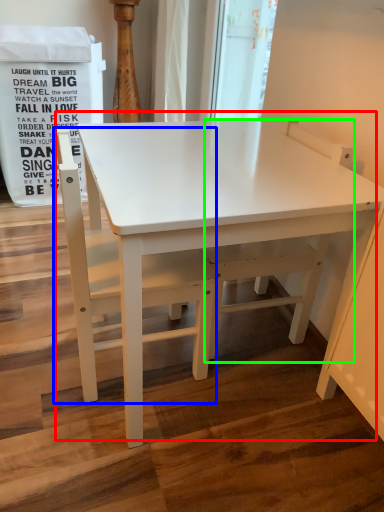
Question: Considering the real-world distances, which object is closest to table (highlighted by a red box)? chair (highlighted by a blue box) or swivel chair (highlighted by a green box).

Choices:
 (A) chair
 (B) swivel chair

Answer: (A)